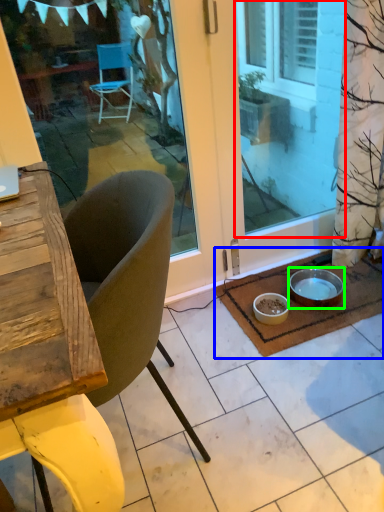
Question: Estimate the real-world distances between objects in this image. Which object is farther from window screen (highlighted by a red box), doormat (highlighted by a blue box) or bowl (highlighted by a green box)?

Choices:
 (A) doormat
 (B) bowl

Answer: (B)